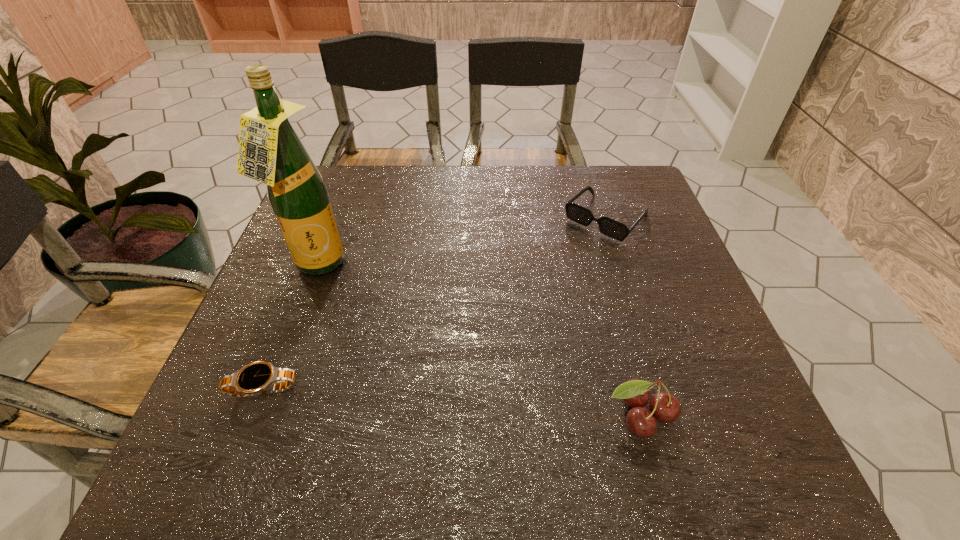
I want to click on free space between the second shortest object and the watch, so click(x=435, y=303).

Locate an element on the screen. The width and height of the screenshot is (960, 540). free space that is in between the sunglasses and the shortest object is located at coordinates (435, 303).

Locate an element on the screen. The image size is (960, 540). free space between the shortest object and the sunglasses is located at coordinates (435, 303).

Where is `free space between the cherry and the tallest object`? free space between the cherry and the tallest object is located at coordinates (477, 341).

At what (x,y) coordinates should I click in order to perform the action: click on empty location between the tallest object and the watch. Please return your answer as a coordinate pair (x, y). Image resolution: width=960 pixels, height=540 pixels. Looking at the image, I should click on click(x=289, y=327).

I want to click on free space between the liquor and the second shortest object, so 461,242.

I want to click on vacant space in between the watch and the sunglasses, so (x=435, y=303).

Image resolution: width=960 pixels, height=540 pixels. Identify the location of unoccupied position between the second tallest object and the watch. (451, 402).

Identify which object is located as the second nearest to the shortest object. Please provide its 2D coordinates. Your answer should be formatted as a tuple, i.e. [(x, y)], where the tuple contains the x and y coordinates of a point satisfying the conditions above.

[(665, 407)]

Identify which object is the closest to the second tallest object. Please provide its 2D coordinates. Your answer should be formatted as a tuple, i.e. [(x, y)], where the tuple contains the x and y coordinates of a point satisfying the conditions above.

[(607, 226)]